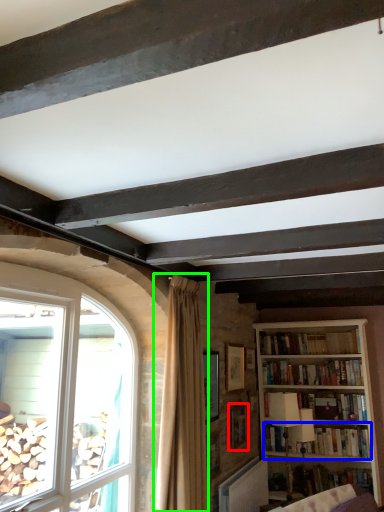
Question: Estimate the real-world distances between objects in this image. Which object is farther from picture frame (highlighted by a red box), book (highlighted by a blue box) or curtain (highlighted by a green box)?

Choices:
 (A) book
 (B) curtain

Answer: (B)